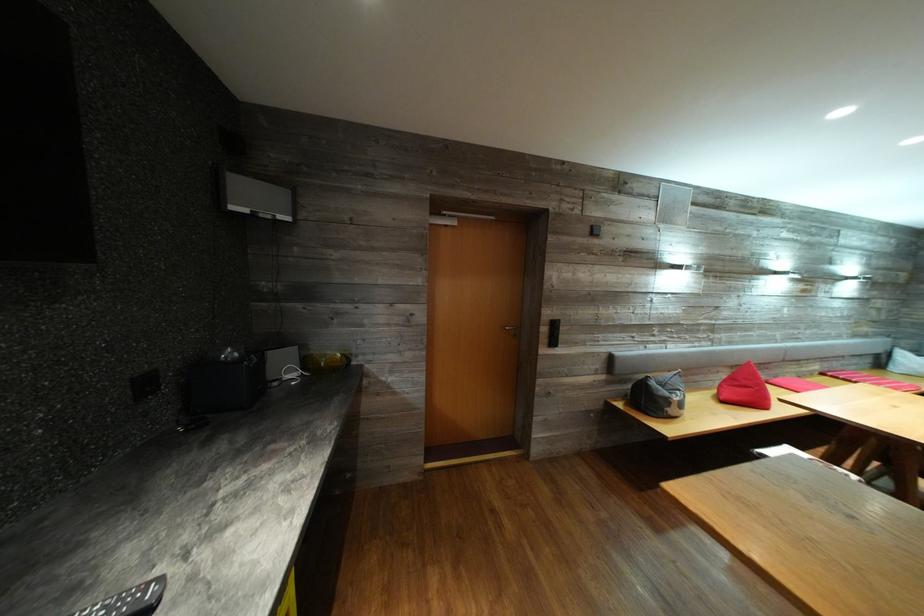
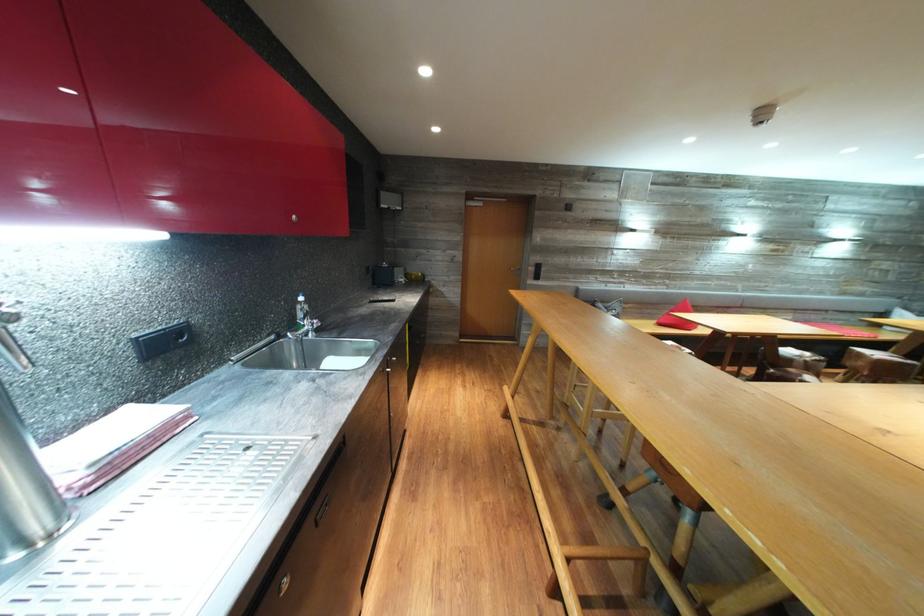
Question: In a continuous first-person perspective shot, in which direction is the camera moving?

Choices:
 (A) Left
 (B) Right
 (C) Forward
 (D) Backward

Answer: (D)